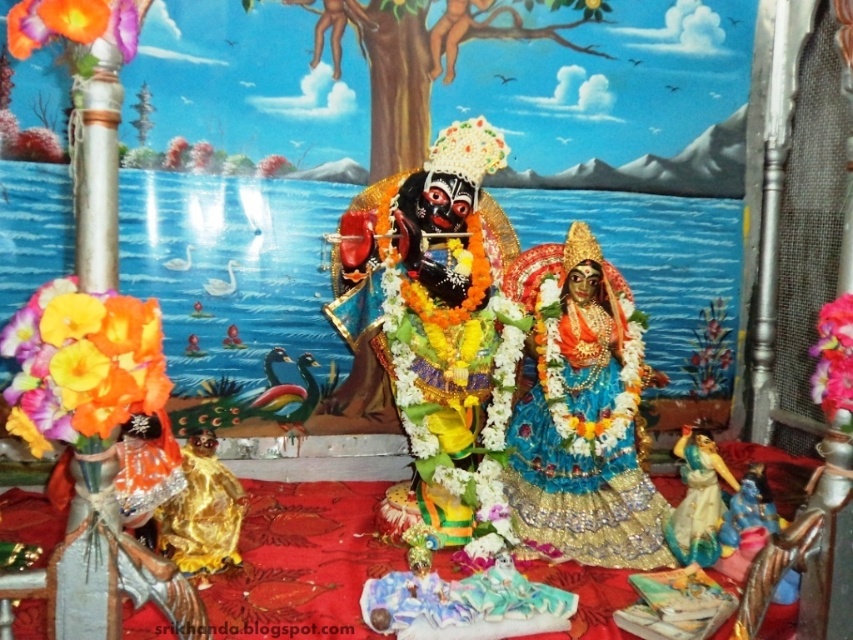
Is polished gold statue at center in front of matte orange flower at left?

No, polished gold statue at center is further to the viewer.

Is polished gold statue at center below matte orange flower at left?

Actually, polished gold statue at center is above matte orange flower at left.

What do you see at coordinates (440, 332) in the screenshot? The height and width of the screenshot is (640, 853). I see `polished gold statue at center` at bounding box center [440, 332].

At what (x,y) coordinates should I click in order to perform the action: click on polished gold statue at center. Please return your answer as a coordinate pair (x, y). The height and width of the screenshot is (640, 853). Looking at the image, I should click on pyautogui.click(x=440, y=332).

Between polished gold statue at center and blue silk saree at center, which one has more height?

Standing taller between the two is polished gold statue at center.

Which is more to the right, polished gold statue at center or blue silk saree at center?

blue silk saree at center

Find the location of `polished gold statue at center`. polished gold statue at center is located at coordinates (440, 332).

Is point (630, 480) positioned before point (815, 378)?

No, it is not.

Who is positioned more to the left, blue silk saree at center or floral garland at center?

blue silk saree at center

You are a GUI agent. You are given a task and a screenshot of the screen. Output one action in this format:
    pyautogui.click(x=<x>, y=<y>)
    Task: Click on the blue silk saree at center
    The image size is (853, 640).
    Given the screenshot: What is the action you would take?
    pyautogui.click(x=583, y=413)